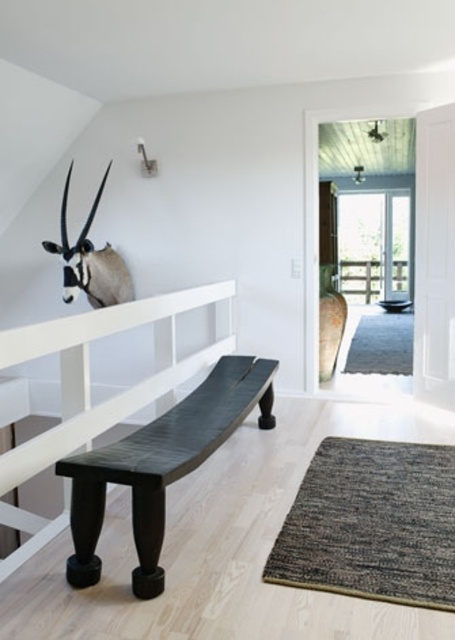
Question: Is dark wood bench at center positioned before white matte antelope head at upper left?

Choices:
 (A) yes
 (B) no

Answer: (A)

Question: Among these points, which one is nearest to the camera?

Choices:
 (A) (97, 252)
 (B) (207, 444)

Answer: (B)

Question: Does dark wood bench at center appear under white matte antelope head at upper left?

Choices:
 (A) no
 (B) yes

Answer: (B)

Question: Does dark wood bench at center have a greater width compared to white matte antelope head at upper left?

Choices:
 (A) yes
 (B) no

Answer: (A)